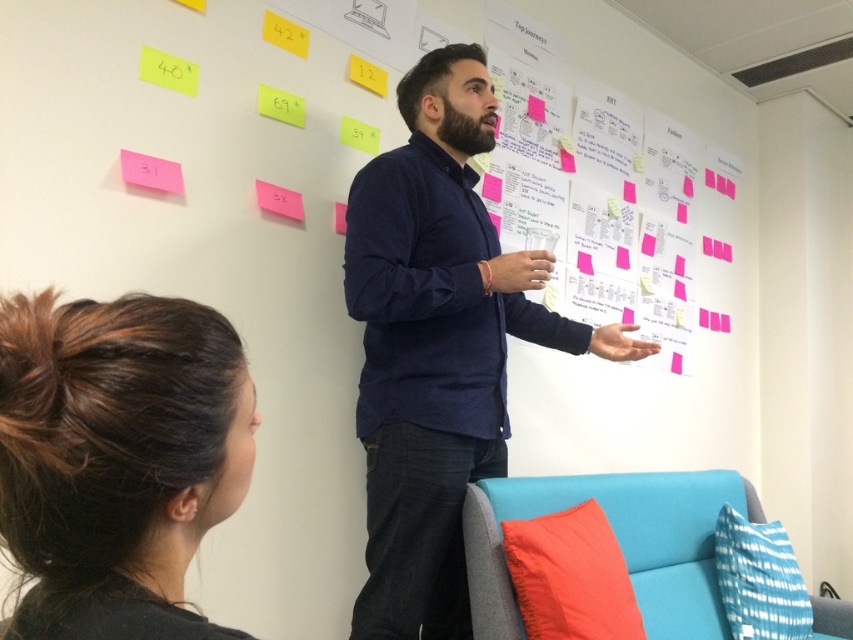
Question: Among these objects, which one is farthest from the camera?

Choices:
 (A) dark blue shirt at center
 (B) pink paper at upper center
 (C) dark brown hair at lower left
 (D) yellow paper at upper left

Answer: (B)

Question: Which is farther from the dark blue shirt at center?

Choices:
 (A) pink paper at upper center
 (B) yellow paper at upper left

Answer: (B)

Question: Does yellow paper at upper left appear under pink paper at upper center?

Choices:
 (A) no
 (B) yes

Answer: (A)

Question: Which is nearer to the pink paper at upper center?

Choices:
 (A) dark blue shirt at center
 (B) yellow paper at upper left

Answer: (B)

Question: From the image, what is the correct spatial relationship of dark blue shirt at center in relation to pink paper at upper center?

Choices:
 (A) left
 (B) right

Answer: (B)

Question: In this image, where is dark blue shirt at center located relative to yellow paper at upper left?

Choices:
 (A) below
 (B) above

Answer: (A)